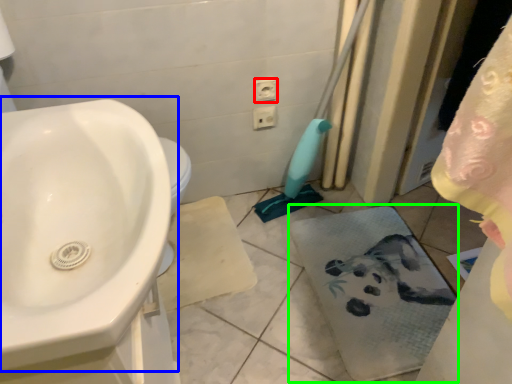
Question: Considering the real-world distances, which object is closest to electric outlet (highlighted by a red box)? sink (highlighted by a blue box) or bath towel (highlighted by a green box).

Choices:
 (A) sink
 (B) bath towel

Answer: (B)